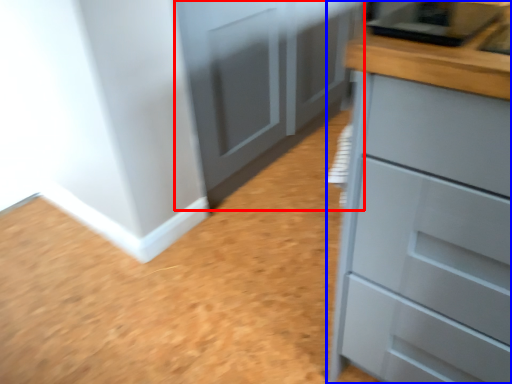
Question: Which point is further to the camera, cupboard (highlighted by a red box) or chest of drawers (highlighted by a blue box)?

Choices:
 (A) cupboard
 (B) chest of drawers

Answer: (A)